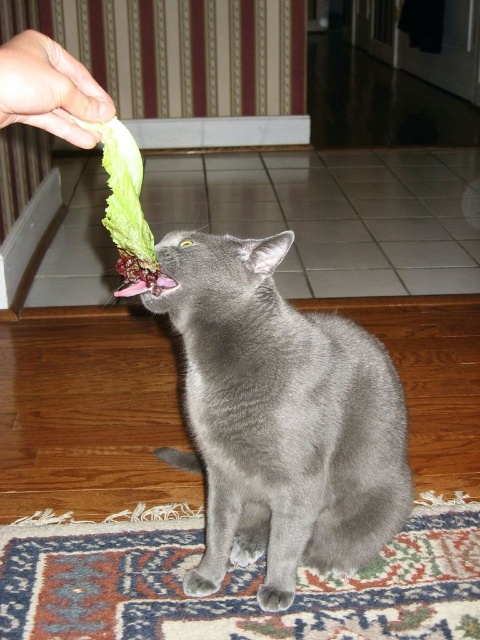
Question: Can you confirm if smooth gray cat at center is wider than pink glossy lips at center?

Choices:
 (A) yes
 (B) no

Answer: (A)

Question: Which is farther from the green leafy lettuce at upper left?

Choices:
 (A) smooth gray cat at center
 (B) pink glossy lips at center
 (C) smooth skin hand at upper left

Answer: (A)

Question: Is smooth skin hand at upper left further to the viewer compared to pink glossy lips at center?

Choices:
 (A) yes
 (B) no

Answer: (B)

Question: Which point appears farthest from the camera in this image?

Choices:
 (A) (107, 208)
 (B) (351, 570)
 (C) (151, 285)

Answer: (B)

Question: Is smooth gray cat at center to the right of smooth skin hand at upper left from the viewer's perspective?

Choices:
 (A) yes
 (B) no

Answer: (A)

Question: Among these objects, which one is nearest to the camera?

Choices:
 (A) smooth gray cat at center
 (B) pink glossy lips at center
 (C) green leafy lettuce at upper left

Answer: (C)